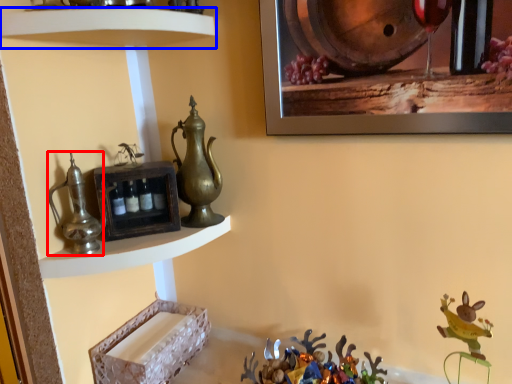
Question: Which object is further to the camera taking this photo, jug (highlighted by a red box) or shelf (highlighted by a blue box)?

Choices:
 (A) jug
 (B) shelf

Answer: (A)